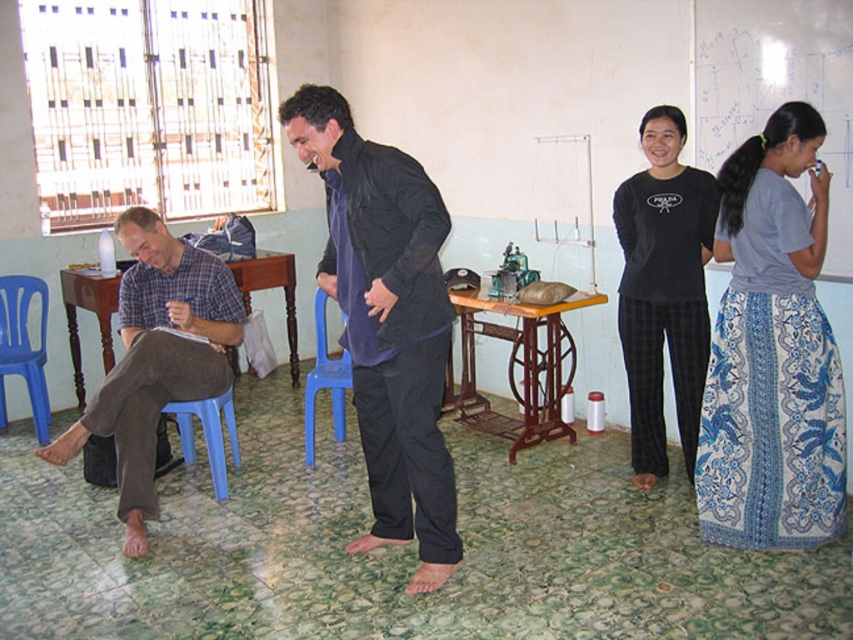
Question: Is plaid fabric shirt at left in front of blue plastic chair at center?

Choices:
 (A) no
 (B) yes

Answer: (B)

Question: Which object is the farthest from the dark blue fabric shirt at center?

Choices:
 (A) blue printed skirt at right
 (B) blue plastic stool at lower left

Answer: (A)

Question: Which is nearer to the blue plastic chair at left?

Choices:
 (A) blue plastic stool at lower left
 (B) blue printed skirt at right

Answer: (A)

Question: Does black cotton pants at center have a larger size compared to blue plastic chair at center?

Choices:
 (A) no
 (B) yes

Answer: (A)

Question: Observing the image, what is the correct spatial positioning of dark blue fabric shirt at center in reference to black cotton pants at center?

Choices:
 (A) left
 (B) right

Answer: (A)

Question: Based on their relative distances, which object is farther from the blue printed skirt at right?

Choices:
 (A) dark blue fabric shirt at center
 (B) black cotton pants at center
 (C) plaid fabric shirt at left
 (D) blue plastic stool at lower left

Answer: (D)